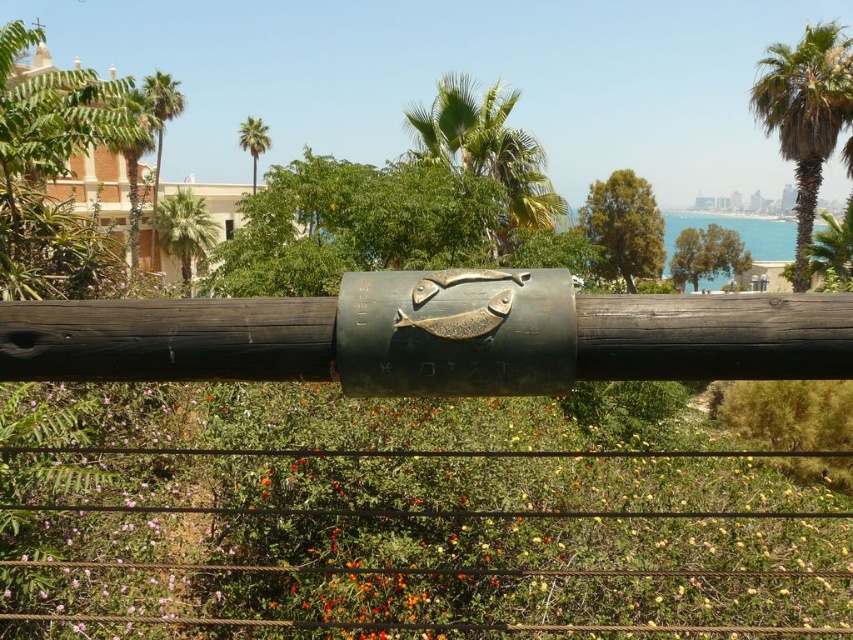
You are a gardener who wants to plant a new palm tree in this scene. The new palm tree must be placed between the green leafy palm tree at center and the green leafy palm at upper center. Which of the two existing palm trees should the new palm be closer to in order to maintain a balanced arrangement?

The new palm tree should be closer to the green leafy palm at upper center. Since the green leafy palm tree at center is wider, placing the new palm closer to the narrower green leafy palm at upper center would help balance the overall arrangement.

You are standing at the center of the image and want to locate the green leafy palm tree at center. What are the coordinates where you should look?

The green leafy palm tree at center is located at coordinates point (486,150).